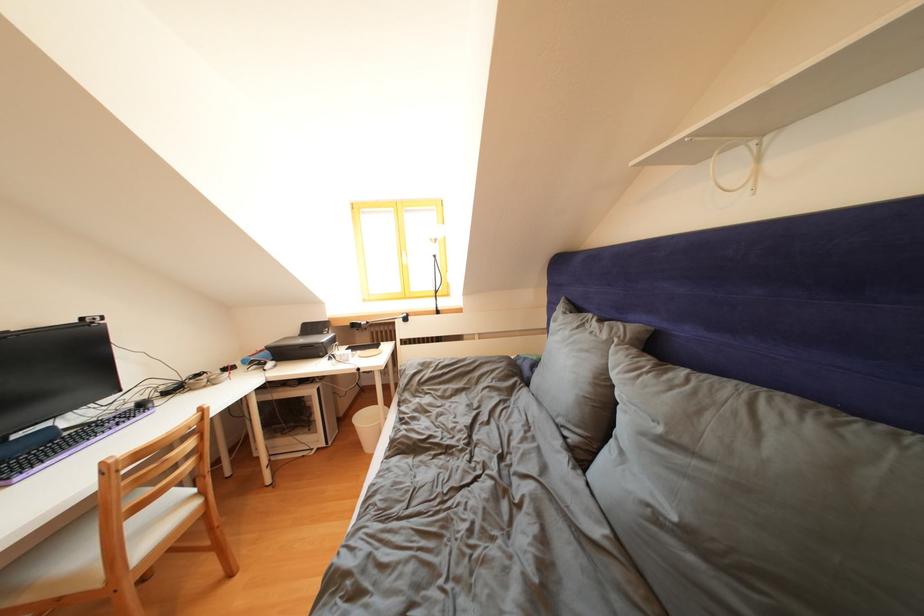
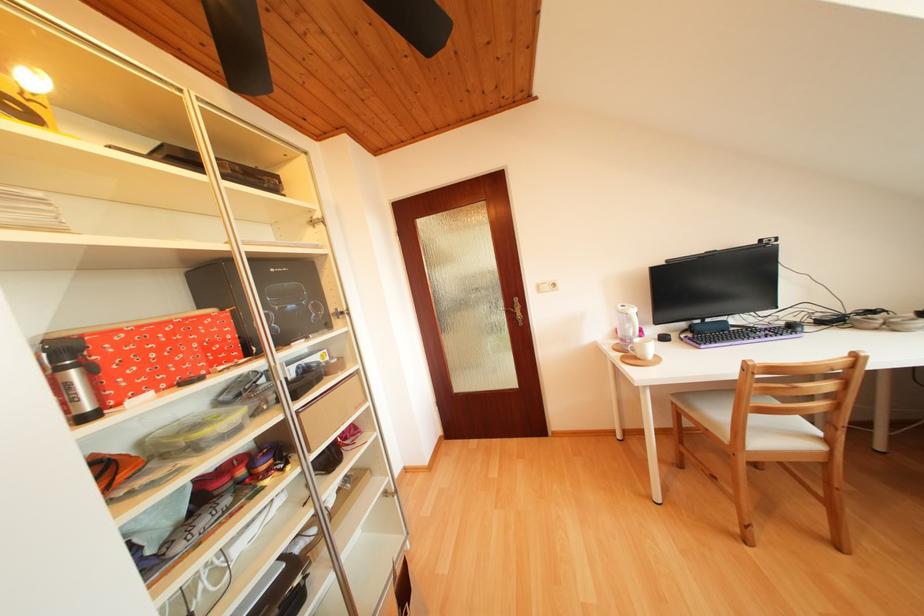
The point at (151, 411) is marked in the first image. Where is the corresponding point in the second image?

(799, 331)